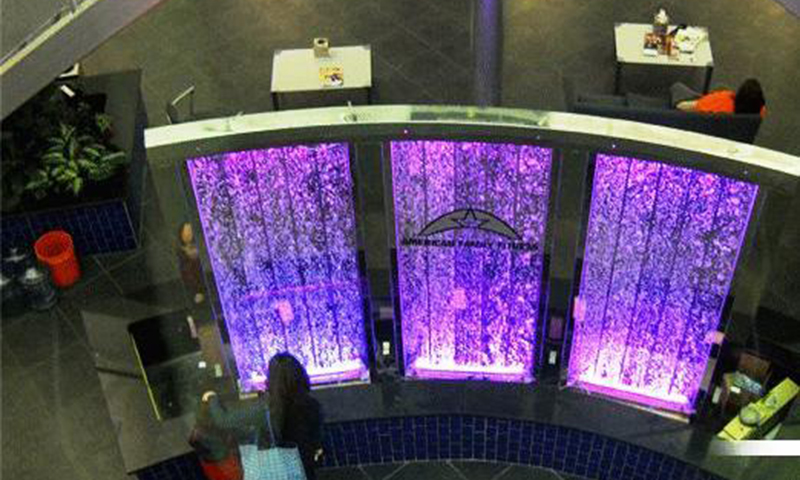
You are a GUI agent. You are given a task and a screenshot of the screen. Output one action in this format:
    pyautogui.click(x=<x>, y=<y>)
    Task: Click on the sofa
    
    Given the screenshot: What is the action you would take?
    pyautogui.click(x=640, y=110)